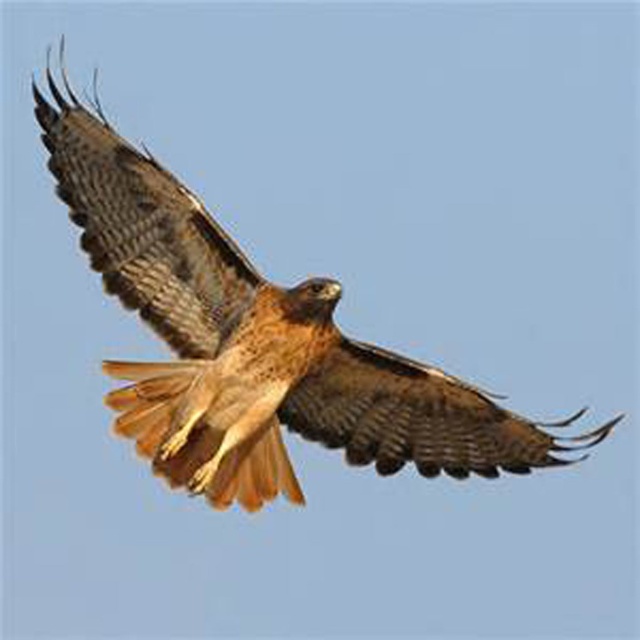
Question: Can you confirm if brown feathered eagle at center is thinner than brown feathered wing at center?

Choices:
 (A) yes
 (B) no

Answer: (B)

Question: Does brown feathered eagle at center have a greater width compared to brown feathered wing at center?

Choices:
 (A) yes
 (B) no

Answer: (A)

Question: Which object appears farthest from the camera in this image?

Choices:
 (A) brown feathered wing at center
 (B) brown textured wing at upper left
 (C) brown feathered eagle at center

Answer: (A)

Question: Which is nearer to the brown textured wing at upper left?

Choices:
 (A) brown feathered wing at center
 (B) brown feathered eagle at center

Answer: (B)

Question: Does brown textured wing at upper left have a lesser width compared to brown feathered wing at center?

Choices:
 (A) no
 (B) yes

Answer: (A)

Question: Which of the following is the closest to the observer?

Choices:
 (A) (x=102, y=280)
 (B) (x=54, y=84)

Answer: (B)